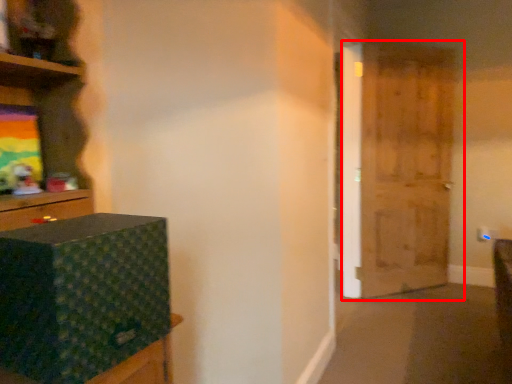
Question: In this image, where is door (annotated by the red box) located relative to box?

Choices:
 (A) left
 (B) right

Answer: (B)